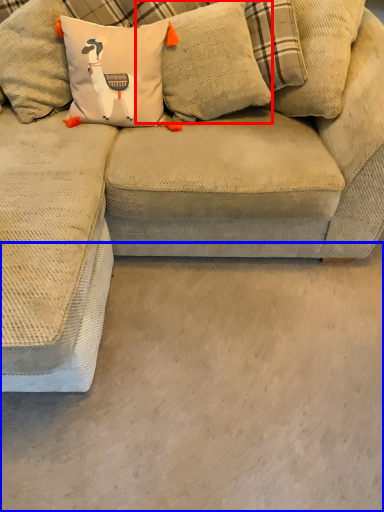
Question: Which object appears closest to the camera in this image, pillow (highlighted by a red box) or concrete (highlighted by a blue box)?

Choices:
 (A) pillow
 (B) concrete

Answer: (B)